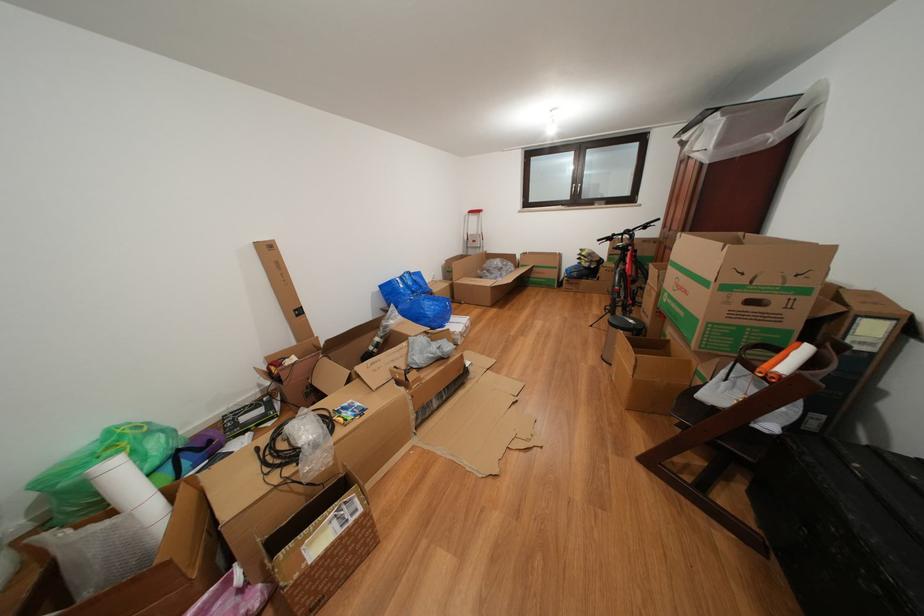
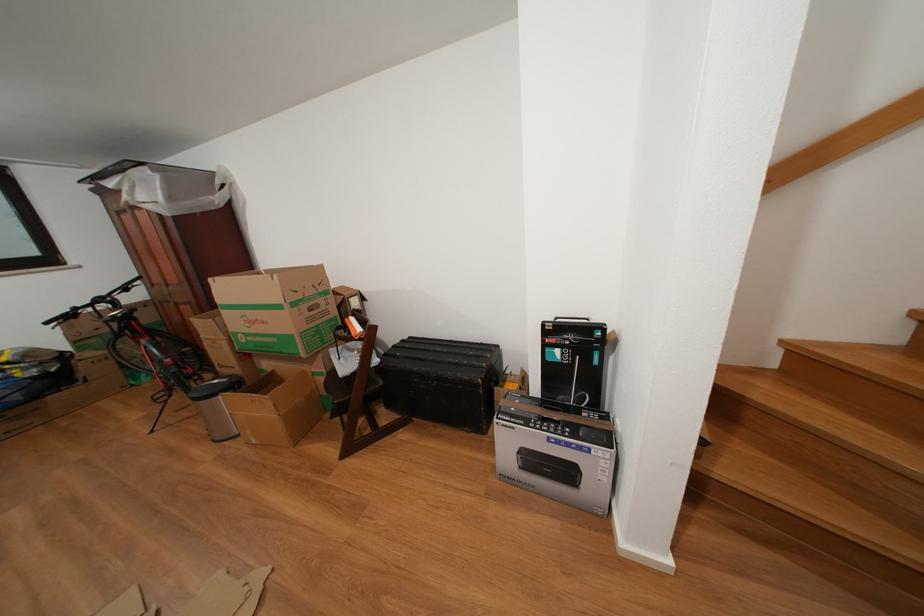
Find the pixel in the second image that matches the point at 694,297 in the first image.

(272, 328)